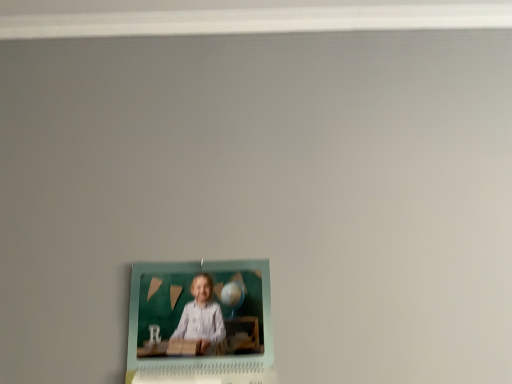
At what (x,y) coordinates should I click in order to perform the action: click on metallic green calendar at center. Please return your answer as a coordinate pair (x, y). Image resolution: width=512 pixels, height=384 pixels. Looking at the image, I should click on (200, 323).

What do you see at coordinates (200, 323) in the screenshot? The image size is (512, 384). I see `metallic green calendar at center` at bounding box center [200, 323].

This screenshot has width=512, height=384. I want to click on metallic green calendar at center, so click(x=200, y=323).